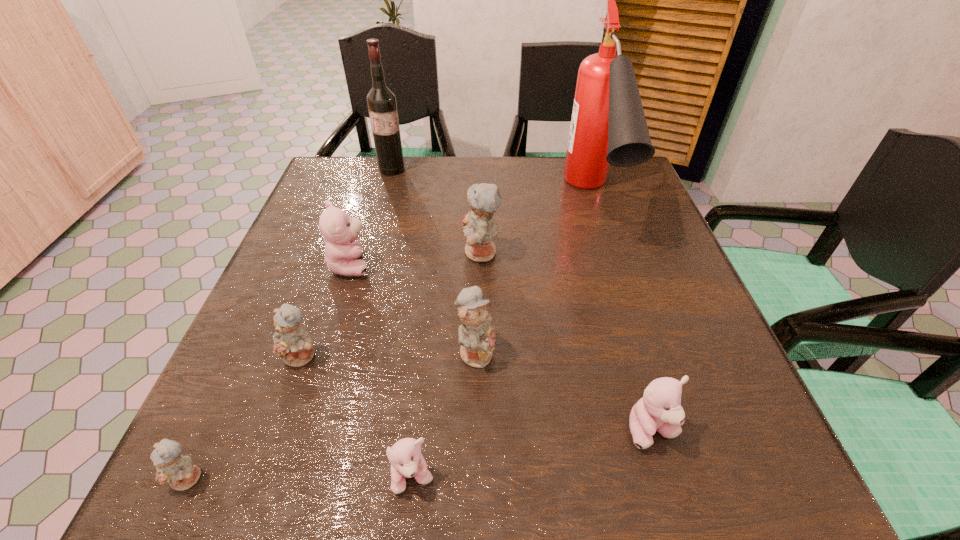
The height and width of the screenshot is (540, 960). Identify the location of the second biggest pink teddy bear. (659, 409).

Find the location of a particular element. This screenshot has height=540, width=960. the nearest blue teddy bear is located at coordinates (179, 471).

Locate an element on the screen. the leftmost teddy bear is located at coordinates (179, 471).

This screenshot has height=540, width=960. I want to click on the second pink teddy bear from left to right, so click(405, 456).

Locate an element on the screen. The height and width of the screenshot is (540, 960). the fifth object from right to left is located at coordinates (405, 456).

Find the location of a particular element. The height and width of the screenshot is (540, 960). vacant space located 0.310m at the nozzle of the red fire extinguisher is located at coordinates (647, 375).

What are the coordinates of `free region located 0.350m on the front and back of the eighth shortest object` in the screenshot? It's located at (367, 261).

At what (x,y) coordinates should I click in order to perform the action: click on free location located 0.170m on the front-facing side of the tallest teddy bear. Please return your answer as a coordinate pair (x, y). Looking at the image, I should click on (386, 253).

Locate an element on the screen. The width and height of the screenshot is (960, 540). free space located 0.230m on the front-facing side of the tallest teddy bear is located at coordinates (359, 253).

Where is `free spot located on the front-facing side of the tallest teddy bear`? The image size is (960, 540). free spot located on the front-facing side of the tallest teddy bear is located at coordinates (287, 253).